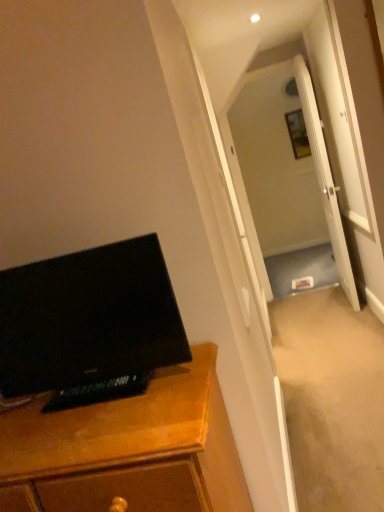
Question: Does wooden picture frame at upper center touch white glossy door at center?

Choices:
 (A) yes
 (B) no

Answer: (B)

Question: Can you confirm if wooden picture frame at upper center is positioned to the left of white glossy door at center?

Choices:
 (A) no
 (B) yes

Answer: (A)

Question: From the image's perspective, would you say wooden picture frame at upper center is shown under white glossy door at center?

Choices:
 (A) yes
 (B) no

Answer: (B)

Question: From a real-world perspective, is wooden picture frame at upper center physically above white glossy door at center?

Choices:
 (A) yes
 (B) no

Answer: (A)

Question: Can you confirm if wooden picture frame at upper center is thinner than white glossy door at center?

Choices:
 (A) no
 (B) yes

Answer: (B)

Question: Is white glossy door at center inside the boundaries of transparent glass door at center, or outside?

Choices:
 (A) outside
 (B) inside

Answer: (A)

Question: From the image's perspective, relative to transparent glass door at center, is white glossy door at center above or below?

Choices:
 (A) above
 (B) below

Answer: (A)

Question: Is point (326, 172) closer or farther from the camera than point (286, 69)?

Choices:
 (A) farther
 (B) closer

Answer: (B)

Question: Is white glossy door at center in front of or behind transparent glass door at center in the image?

Choices:
 (A) front
 (B) behind

Answer: (A)

Question: Considering the positions of white glossy door at center and black glossy monitor at left in the image, is white glossy door at center taller or shorter than black glossy monitor at left?

Choices:
 (A) tall
 (B) short

Answer: (A)

Question: Is white glossy door at center to the left or to the right of black glossy monitor at left in the image?

Choices:
 (A) left
 (B) right

Answer: (B)

Question: Looking at the image, does white glossy door at center seem bigger or smaller compared to black glossy monitor at left?

Choices:
 (A) big
 (B) small

Answer: (A)

Question: From the image's perspective, is white glossy door at center above or below black glossy monitor at left?

Choices:
 (A) below
 (B) above

Answer: (B)

Question: Is black glossy monitor at left in front of or behind wooden cabinet at left in the image?

Choices:
 (A) behind
 (B) front

Answer: (A)

Question: Is black glossy monitor at left taller or shorter than wooden cabinet at left?

Choices:
 (A) short
 (B) tall

Answer: (A)